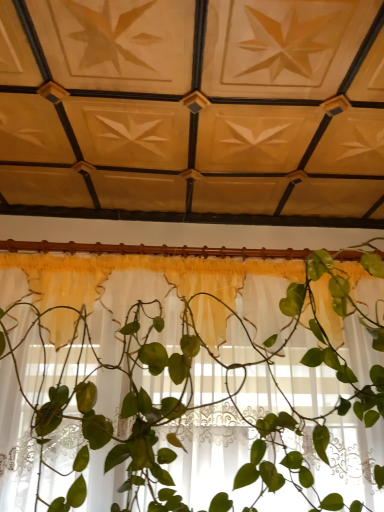
This screenshot has width=384, height=512. What do you see at coordinates (182, 371) in the screenshot?
I see `translucent white curtain at center` at bounding box center [182, 371].

The width and height of the screenshot is (384, 512). Identify the location of translucent white curtain at center. (182, 371).

Find the location of `translucent white curtain at center`. translucent white curtain at center is located at coordinates (182, 371).